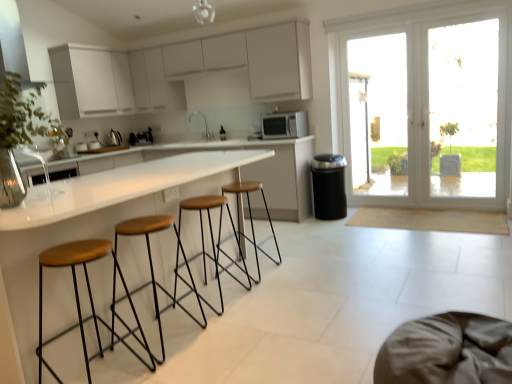
Question: Does white glossy sink at center appear on the right side of transparent glass door at right?

Choices:
 (A) no
 (B) yes

Answer: (A)

Question: Does white glossy sink at center have a smaller size compared to transparent glass door at right?

Choices:
 (A) no
 (B) yes

Answer: (B)

Question: Is white glossy sink at center bigger than transparent glass door at right?

Choices:
 (A) no
 (B) yes

Answer: (A)

Question: Considering the relative sizes of white glossy sink at center and transparent glass door at right in the image provided, is white glossy sink at center taller than transparent glass door at right?

Choices:
 (A) yes
 (B) no

Answer: (B)

Question: Is white glossy sink at center positioned before transparent glass door at right?

Choices:
 (A) yes
 (B) no

Answer: (B)

Question: From a real-world perspective, relative to brown leather stool at center, which appears as the second stool when viewed from the back, is metallic silver vent at upper left vertically above or below?

Choices:
 (A) above
 (B) below

Answer: (A)

Question: Is point (18, 31) closer or farther from the camera than point (221, 221)?

Choices:
 (A) farther
 (B) closer

Answer: (A)

Question: Is metallic silver vent at upper left wider or thinner than brown leather stool at center, acting as the third stool starting from the front?

Choices:
 (A) wide
 (B) thin

Answer: (A)

Question: Would you say metallic silver vent at upper left is to the left or to the right of brown leather stool at center, acting as the third stool starting from the front, in the picture?

Choices:
 (A) right
 (B) left

Answer: (B)

Question: In terms of width, does brown leather stool at center, arranged as the fourth stool when viewed from the front, look wider or thinner when compared to brown leather stool at center, which appears as the second stool when viewed from the back?

Choices:
 (A) thin
 (B) wide

Answer: (B)

Question: From a real-world perspective, relative to brown leather stool at center, which appears as the second stool when viewed from the back, is brown leather stool at center, arranged as the fourth stool when viewed from the front, vertically above or below?

Choices:
 (A) below
 (B) above

Answer: (B)

Question: From the image's perspective, is brown leather stool at center, the 1th stool when ordered from back to front, positioned above or below brown leather stool at center, acting as the third stool starting from the front?

Choices:
 (A) above
 (B) below

Answer: (A)

Question: From their relative heights in the image, would you say brown leather stool at center, the 1th stool when ordered from back to front, is taller or shorter than brown leather stool at center, which appears as the second stool when viewed from the back?

Choices:
 (A) tall
 (B) short

Answer: (A)

Question: Considering the positions of brown fabric swivel chair at lower right and brown leather stool at center, acting as the third stool starting from the front, in the image, is brown fabric swivel chair at lower right taller or shorter than brown leather stool at center, acting as the third stool starting from the front,?

Choices:
 (A) tall
 (B) short

Answer: (B)

Question: Relative to brown leather stool at center, acting as the third stool starting from the front, is brown fabric swivel chair at lower right in front or behind?

Choices:
 (A) front
 (B) behind

Answer: (A)